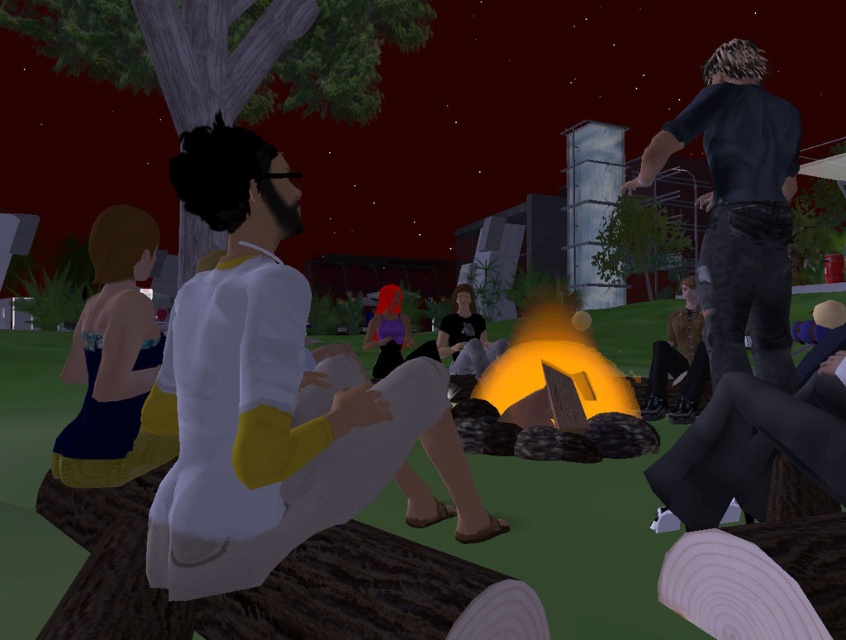
Question: Is white matte shirt at center positioned in front of smooth gray bark at upper left?

Choices:
 (A) no
 (B) yes

Answer: (B)

Question: Which point appears farthest from the camera in this image?

Choices:
 (A) (127, 408)
 (B) (372, 369)

Answer: (B)

Question: Does dark blue shirt at upper right appear under matte black shirt at center?

Choices:
 (A) yes
 (B) no

Answer: (B)

Question: Which object appears closest to the camera in this image?

Choices:
 (A) matte black shirt at center
 (B) shiny purple hair at center
 (C) white matte shirt at center
 (D) smooth gray bark at upper left

Answer: (C)

Question: Which object is positioned farthest from the smooth gray bark at upper left?

Choices:
 (A) white matte shirt at center
 (B) matte black shirt at center
 (C) dark blue shirt at upper right
 (D) shiny purple hair at center

Answer: (A)

Question: Can you confirm if white matte shirt at center is positioned below matte black shirt at center?

Choices:
 (A) no
 (B) yes

Answer: (B)